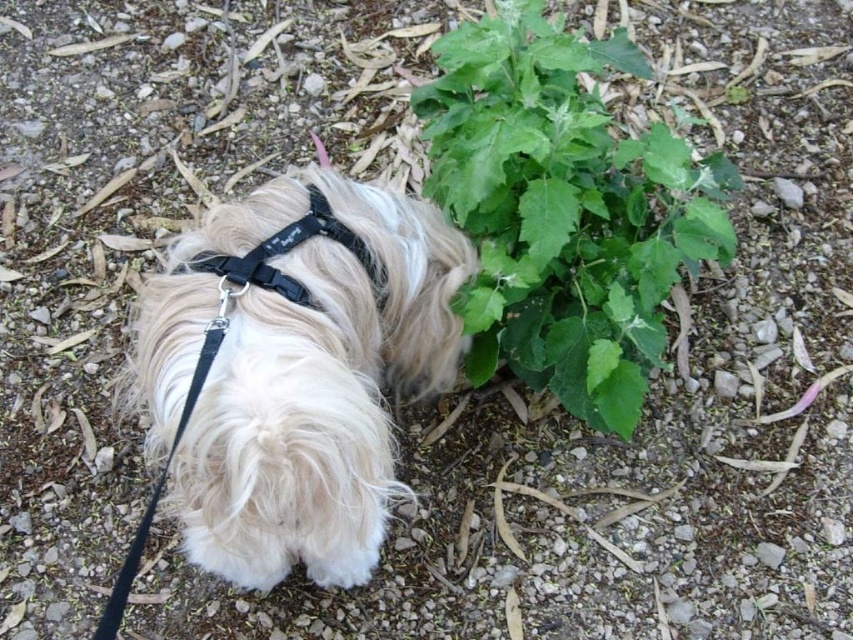
You are a photographer trying to capture the white fluffy dog at center and the green leafy plant at center in the same frame. Based on their positions, which one would appear larger in the photo?

The white fluffy dog at center appears larger in the photo because it is closer to the viewer compared to the green leafy plant at center.